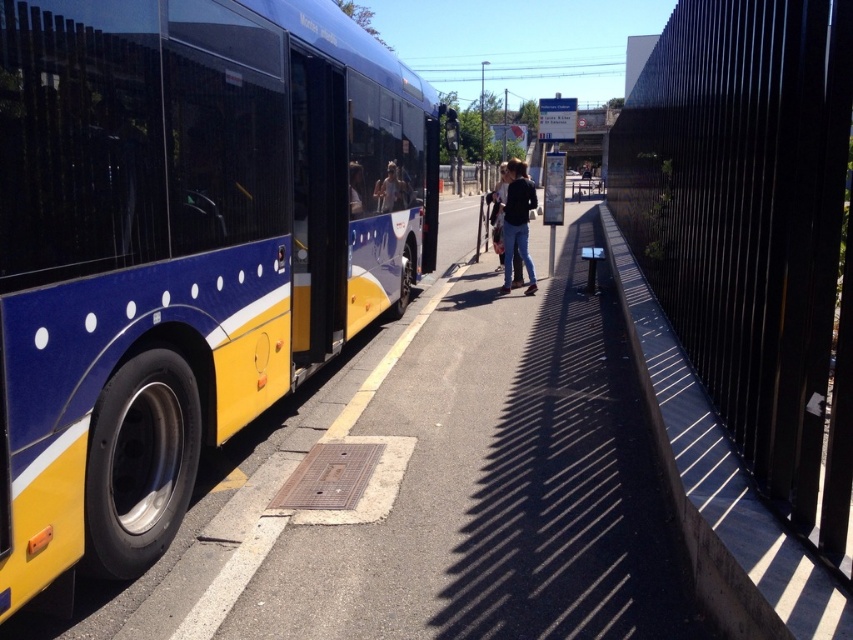
Can you confirm if black concrete curb at right is shorter than denim jacket at center?

Correct, black concrete curb at right is not as tall as denim jacket at center.

Where is `black concrete curb at right`? black concrete curb at right is located at coordinates (718, 490).

The height and width of the screenshot is (640, 853). I want to click on black concrete curb at right, so click(718, 490).

Can you confirm if smooth asphalt pavement at center is positioned above black concrete curb at right?

No, smooth asphalt pavement at center is not above black concrete curb at right.

Does point (422, 468) lie in front of point (672, 486)?

No, it is not.

At what (x,y) coordinates should I click in order to perform the action: click on smooth asphalt pavement at center. Please return your answer as a coordinate pair (x, y). Looking at the image, I should click on (444, 490).

Does smooth asphalt pavement at center appear on the right side of denim jacket at center?

No, smooth asphalt pavement at center is not to the right of denim jacket at center.

Does smooth asphalt pavement at center have a greater height compared to denim jacket at center?

No.

Between point (613, 512) and point (531, 280), which one is positioned in front?

Point (613, 512)

Where is `smooth asphalt pavement at center`? smooth asphalt pavement at center is located at coordinates (444, 490).